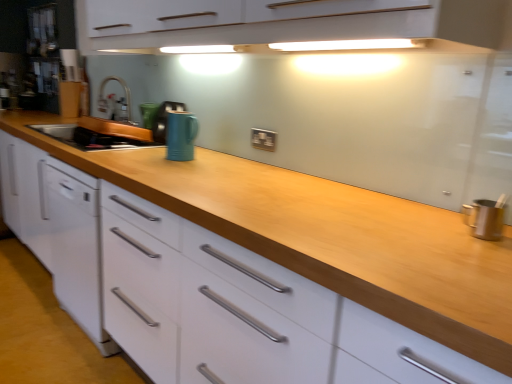
The image size is (512, 384). Describe the element at coordinates (485, 218) in the screenshot. I see `metallic silver utensil holder at right` at that location.

This screenshot has width=512, height=384. What do you see at coordinates (263, 139) in the screenshot?
I see `black plastic electric outlet at center` at bounding box center [263, 139].

I want to click on white glossy cabinet at upper center, so click(x=289, y=25).

The height and width of the screenshot is (384, 512). What do you see at coordinates (289, 25) in the screenshot?
I see `white glossy cabinet at upper center` at bounding box center [289, 25].

Image resolution: width=512 pixels, height=384 pixels. What do you see at coordinates (75, 246) in the screenshot?
I see `white glossy dishwasher at left` at bounding box center [75, 246].

At what (x,y) coordinates should I click in order to perform the action: click on satin nickel faucet at center. Please return your answer as a coordinate pair (x, y). Looking at the image, I should click on (114, 101).

Would you say wooden at center is part of satin nickel faucet at center's contents?

No, satin nickel faucet at center does not contain wooden at center.

Which is nearer, [120,83] or [404,247]?

Point [120,83].

The width and height of the screenshot is (512, 384). I want to click on countertop below the satin nickel faucet at center (from a real-world perspective), so click(328, 236).

Does satin nickel faucet at center have a greater height compared to wooden at center?

No.

Which object is positioned more to the left, matte blue mug at center, positioned as the first appliance in front-to-back order, or white glossy dishwasher at left?

From the viewer's perspective, white glossy dishwasher at left appears more on the left side.

Considering the sizes of objects matte blue mug at center, positioned as the first appliance in front-to-back order, and white glossy dishwasher at left in the image provided, who is wider, matte blue mug at center, positioned as the first appliance in front-to-back order, or white glossy dishwasher at left?

With larger width is white glossy dishwasher at left.

Is matte blue mug at center, positioned as the first appliance in front-to-back order, bigger or smaller than white glossy dishwasher at left?

Considering their sizes, matte blue mug at center, positioned as the first appliance in front-to-back order, takes up less space than white glossy dishwasher at left.

Choose the correct answer: Is matte blue mug at center, which is the third appliance in back-to-front order, inside white glossy dishwasher at left or outside it?

matte blue mug at center, which is the third appliance in back-to-front order, is not enclosed by white glossy dishwasher at left.

From a real-world perspective, is matte blue mug at center, which is the third appliance in back-to-front order, positioned over metallic silver utensil holder at right based on gravity?

Indeed, from a real-world perspective, matte blue mug at center, which is the third appliance in back-to-front order, stands above metallic silver utensil holder at right.

From the image's perspective, is matte blue mug at center, positioned as the first appliance in front-to-back order, located above or below metallic silver utensil holder at right?

From the image's perspective, matte blue mug at center, positioned as the first appliance in front-to-back order, appears above metallic silver utensil holder at right.

Is point (174, 150) farther from viewer compared to point (497, 217)?

Yes, point (174, 150) is farther from viewer.

Is satin nickel faucet at center bigger than green ceramic mug at upper center, the 1th appliance in the back-to-front sequence?

Yes, satin nickel faucet at center is bigger than green ceramic mug at upper center, the 1th appliance in the back-to-front sequence.

How different are the orientations of satin nickel faucet at center and green ceramic mug at upper center, the 3th appliance in the front-to-back sequence, in degrees?

The facing directions of satin nickel faucet at center and green ceramic mug at upper center, the 3th appliance in the front-to-back sequence, are 0.000558 degrees apart.

Consider the image. Does satin nickel faucet at center turn towards green ceramic mug at upper center, the 3th appliance in the front-to-back sequence?

No.

Is point (112, 111) positioned behind point (156, 104)?

Yes, it is behind point (156, 104).

The width and height of the screenshot is (512, 384). What are the coordinates of `cabinetry that appears above the matte blue mug at center, which is the third appliance in back-to-front order (from the image's perspective)` in the screenshot? It's located at (289, 25).

Is white glossy cabinet at upper center at the left side of matte blue mug at center, which is the third appliance in back-to-front order?

Incorrect, white glossy cabinet at upper center is not on the left side of matte blue mug at center, which is the third appliance in back-to-front order.

Would you say white glossy cabinet at upper center is a long distance from matte blue mug at center, which is the third appliance in back-to-front order?

That's not correct — white glossy cabinet at upper center is a little close to matte blue mug at center, which is the third appliance in back-to-front order.

Does point (208, 47) lie in front of point (172, 147)?

No.

Which object is positioned more to the left, wooden at center or white glossy cabinet at upper center?

white glossy cabinet at upper center is more to the left.

Does wooden at center have a lesser height compared to white glossy cabinet at upper center?

No.

Is point (178, 212) farther from viewer compared to point (110, 15)?

That is False.

Is matte blue mug at center, positioned as the first appliance in front-to-back order, situated inside white glossy cabinet at upper center or outside?

matte blue mug at center, positioned as the first appliance in front-to-back order, is located beyond the bounds of white glossy cabinet at upper center.

Considering the relative positions of matte blue mug at center, positioned as the first appliance in front-to-back order, and white glossy cabinet at upper center in the image provided, is matte blue mug at center, positioned as the first appliance in front-to-back order, in front of white glossy cabinet at upper center?

No, it is not.

Could you tell me if matte blue mug at center, which is the third appliance in back-to-front order, is facing white glossy cabinet at upper center?

No, matte blue mug at center, which is the third appliance in back-to-front order, is not turned towards white glossy cabinet at upper center.

There is a wooden at center. Where is `faucet above it (from a real-world perspective)`? The height and width of the screenshot is (384, 512). faucet above it (from a real-world perspective) is located at coordinates (114, 101).

Find the location of a particular element. home appliance lying in front of the matte blue mug at center, which is the third appliance in back-to-front order is located at coordinates (75, 246).

Estimate the real-world distances between objects in this image. Which object is closer to matte blue mug at center, which is the third appliance in back-to-front order, wooden at center or metallic silver utensil holder at right?

Among the two, wooden at center is located nearer to matte blue mug at center, which is the third appliance in back-to-front order.

Which object lies further to the anchor point white glossy cabinet at upper center, white glossy dishwasher at left or metallic silver utensil holder at right?

Based on the image, white glossy dishwasher at left appears to be further to white glossy cabinet at upper center.

Estimate the real-world distances between objects in this image. Which object is closer to white glossy dishwasher at left, metallic silver utensil holder at right or glossy ceramic mug at center, which appears as the second appliance when viewed from the front?

Among the two, glossy ceramic mug at center, which appears as the second appliance when viewed from the front, is located nearer to white glossy dishwasher at left.

When comparing their distances from metallic silver utensil holder at right, does white glossy cabinet at upper center or green ceramic mug at upper center, the 3th appliance in the front-to-back sequence, seem further?

The object further to metallic silver utensil holder at right is green ceramic mug at upper center, the 3th appliance in the front-to-back sequence.

From the image, which object appears to be farther from satin nickel faucet at center, white glossy cabinet at upper center or metallic silver utensil holder at right?

The object further to satin nickel faucet at center is metallic silver utensil holder at right.

Considering their positions, is satin nickel faucet at center positioned further to wooden at center than white glossy dishwasher at left?

satin nickel faucet at center lies further to wooden at center than the other object.

Which object lies nearer to the anchor point metallic silver utensil holder at right, wooden at center or glossy ceramic mug at center, which is counted as the second appliance, starting from the back?

wooden at center.

From the image, which object appears to be farther from white glossy cabinet at upper center, black plastic electric outlet at center or metallic silver utensil holder at right?

metallic silver utensil holder at right is further to white glossy cabinet at upper center.

Image resolution: width=512 pixels, height=384 pixels. In order to click on appliance between white glossy cabinet at upper center and glossy ceramic mug at center, which is counted as the second appliance, starting from the back, along the z-axis in this screenshot , I will do `click(181, 135)`.

In order to click on electric outlet between white glossy cabinet at upper center and glossy ceramic mug at center, which is counted as the second appliance, starting from the back, along the z-axis in this screenshot , I will do `click(263, 139)`.

You are a GUI agent. You are given a task and a screenshot of the screen. Output one action in this format:
    pyautogui.click(x=<x>, y=<y>)
    Task: Click on the home appliance between wooden at center and green ceramic mug at upper center, the 3th appliance in the front-to-back sequence, along the z-axis
    
    Given the screenshot: What is the action you would take?
    pyautogui.click(x=75, y=246)

Locate an element on the screen. The image size is (512, 384). electric outlet between wooden at center and glossy ceramic mug at center, which appears as the second appliance when viewed from the front, along the z-axis is located at coordinates (263, 139).